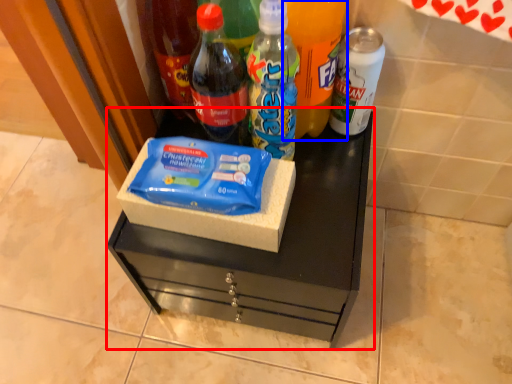
Question: Among these objects, which one is farthest to the camera, vanity (highlighted by a red box) or bottle (highlighted by a blue box)?

Choices:
 (A) vanity
 (B) bottle

Answer: (A)